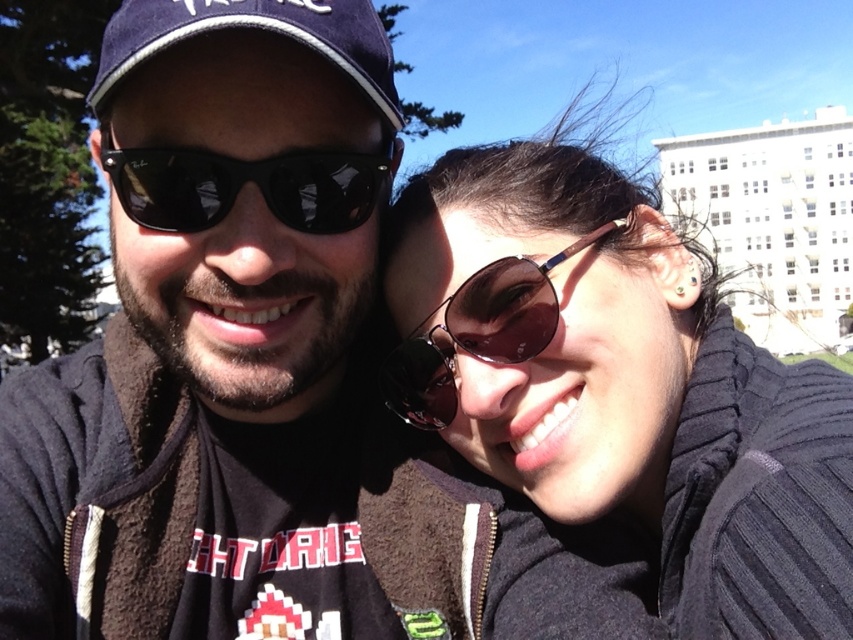
Question: Does matte black sunglasses at center have a smaller size compared to navy blue fabric baseball cap at upper left?

Choices:
 (A) yes
 (B) no

Answer: (B)

Question: Can you confirm if sunglasses at upper right is positioned above navy blue fabric baseball cap at upper left?

Choices:
 (A) yes
 (B) no

Answer: (B)

Question: Which point appears farthest from the camera in this image?

Choices:
 (A) (508, 339)
 (B) (358, 556)

Answer: (B)

Question: Can you confirm if matte black sunglasses at center is bigger than sunglasses at upper right?

Choices:
 (A) yes
 (B) no

Answer: (A)

Question: Among these objects, which one is nearest to the camera?

Choices:
 (A) shiny dark sunglasses at center
 (B) black ray-ban sunglasses at center
 (C) sunglasses at upper right

Answer: (C)

Question: Estimate the real-world distances between objects in this image. Which object is farther from the navy blue fabric baseball cap at upper left?

Choices:
 (A) matte black sunglasses at center
 (B) black ray-ban sunglasses at center
 (C) sunglasses at upper right
 (D) shiny dark sunglasses at center

Answer: (C)